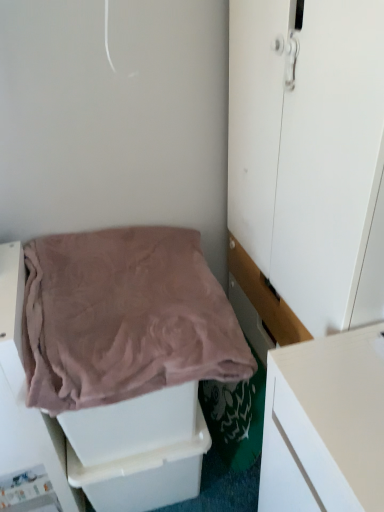
Question: From the image's perspective, would you say white plastic drawer at lower center is shown under pink soft fabric at lower left?

Choices:
 (A) yes
 (B) no

Answer: (A)

Question: Is the depth of white plastic drawer at lower center less than that of pink soft fabric at lower left?

Choices:
 (A) no
 (B) yes

Answer: (A)

Question: Is white plastic drawer at lower center bigger than pink soft fabric at lower left?

Choices:
 (A) yes
 (B) no

Answer: (B)

Question: From the image's perspective, is white plastic drawer at lower center over pink soft fabric at lower left?

Choices:
 (A) no
 (B) yes

Answer: (A)

Question: From a real-world perspective, is white plastic drawer at lower center beneath pink soft fabric at lower left?

Choices:
 (A) yes
 (B) no

Answer: (A)

Question: From their relative heights in the image, would you say pink soft fabric at lower left is taller or shorter than white plastic drawer at lower center?

Choices:
 (A) short
 (B) tall

Answer: (A)

Question: Based on their sizes in the image, would you say pink soft fabric at lower left is bigger or smaller than white plastic drawer at lower center?

Choices:
 (A) small
 (B) big

Answer: (B)

Question: Is point (119, 286) positioned closer to the camera than point (165, 479)?

Choices:
 (A) closer
 (B) farther

Answer: (A)

Question: Is pink soft fabric at lower left inside the boundaries of white plastic drawer at lower center, or outside?

Choices:
 (A) inside
 (B) outside

Answer: (B)

Question: Is white matte door at center inside or outside of white plastic drawer at lower center?

Choices:
 (A) outside
 (B) inside

Answer: (A)

Question: From the image's perspective, relative to white plastic drawer at lower center, is white matte door at center above or below?

Choices:
 (A) above
 (B) below

Answer: (A)

Question: From a real-world perspective, is white matte door at center above or below white plastic drawer at lower center?

Choices:
 (A) below
 (B) above

Answer: (B)

Question: From their relative heights in the image, would you say white matte door at center is taller or shorter than white plastic drawer at lower center?

Choices:
 (A) short
 (B) tall

Answer: (B)

Question: Is white plastic drawer at lower center in front of or behind pink soft fabric at lower left in the image?

Choices:
 (A) front
 (B) behind

Answer: (B)

Question: Is white plastic drawer at lower center to the left or to the right of pink soft fabric at lower left in the image?

Choices:
 (A) right
 (B) left

Answer: (A)